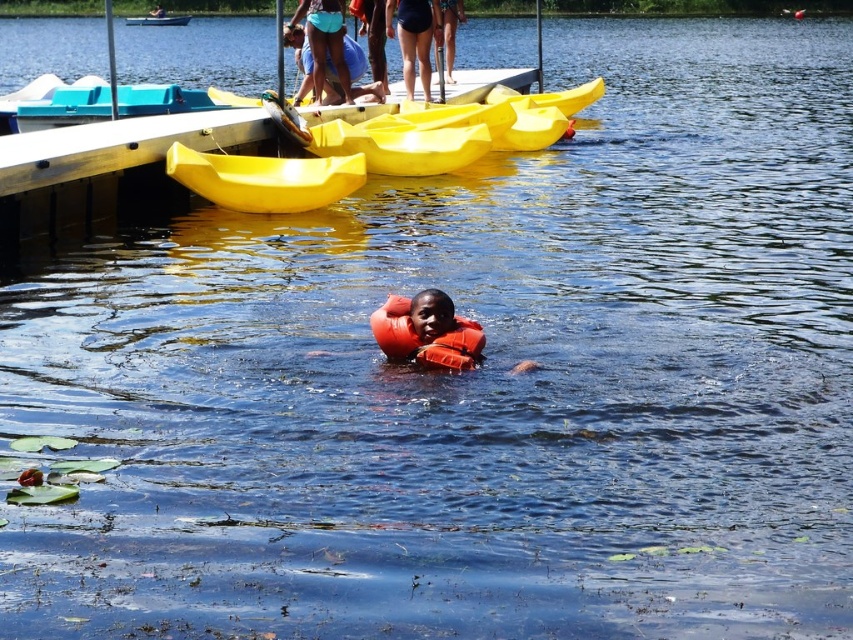
Question: Does yellow matte kayak at upper center lie behind black swimsuit at upper center?

Choices:
 (A) yes
 (B) no

Answer: (B)

Question: Among these objects, which one is nearest to the camera?

Choices:
 (A) teal fabric shorts at upper center
 (B) black swimsuit at upper center

Answer: (B)

Question: Among these points, which one is farthest from the camera?

Choices:
 (A) pyautogui.click(x=418, y=33)
 (B) pyautogui.click(x=329, y=3)

Answer: (A)

Question: Is yellow matte kayak at upper center positioned in front of orange foam life jacket at center?

Choices:
 (A) no
 (B) yes

Answer: (A)

Question: Based on their relative distances, which object is farther from the yellow plastic boat at upper center?

Choices:
 (A) orange foam life jacket at center
 (B) yellow matte kayak at upper center
 (C) teal fabric shorts at upper center
 (D) blue denim shorts at upper center

Answer: (A)

Question: Does black swimsuit at upper center lie behind yellow plastic boat at upper center?

Choices:
 (A) yes
 (B) no

Answer: (B)